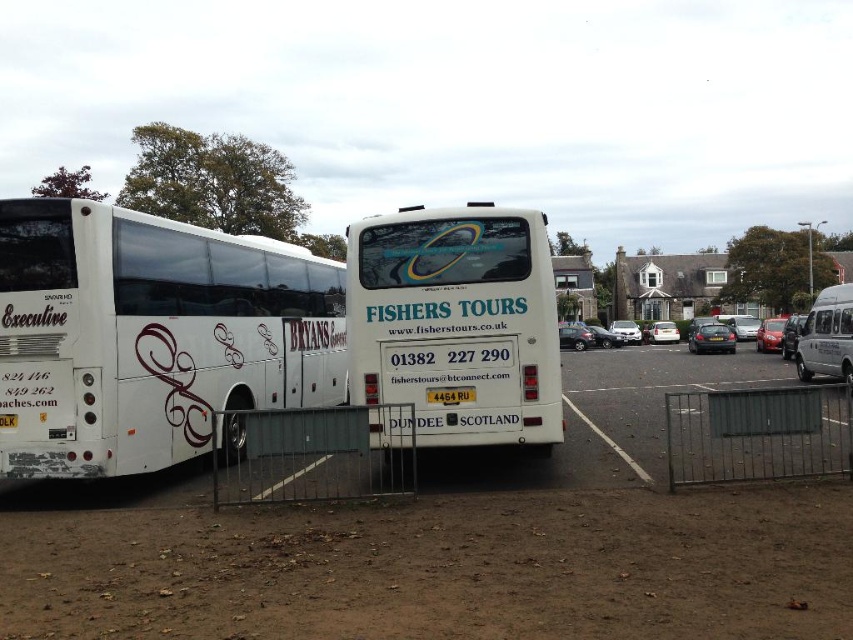
You are a delivery driver who needs to park your truck in the parking area shown. You see the white matte bus at center and the silver metallic sedan at center. Which vehicle should you avoid parking behind to ensure your truck remains visible from the main entrance?

You should avoid parking behind the white matte bus at center because it is positioned over the silver metallic sedan at center, meaning it blocks more of the view from the main entrance.

You are a delivery driver who needs to park your truck, which is 2.5 meters tall, in this parking area. You see the white matte bus at center and the silver metallic sedan at center. Can your truck fit between them vertically?

The white matte bus at center is taller than the silver metallic sedan at center. Since the truck is 2.5 meters tall, it depends on the height of the bus. If the bus is taller than 2.5 meters, the truck might not fit. However, without specific height measurements, we cannot confirm.